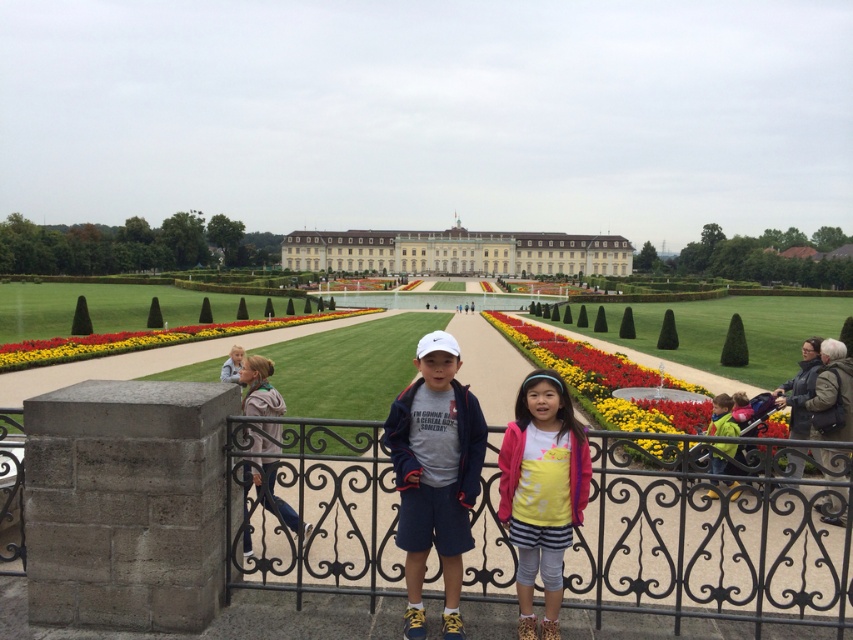
You are standing at the entrance of the garden and want to walk towards the palace. There are two points marked in the image, point (511,432) and point (294,515). Which point is closer to you as you stand at the entrance?

Point (511,432) is closer to the viewer than point (294,515), so the point closer to you is point (511,432).

You are a gardener carrying a matte pink jacket at center and need to pass through an iron wrought fence at center to reach the palace. Can you walk through the fence without folding the jacket?

The iron wrought fence at center is wider than the matte pink jacket at center, so you can walk through the fence without folding the jacket because the fence is wide enough to accommodate the jacket.